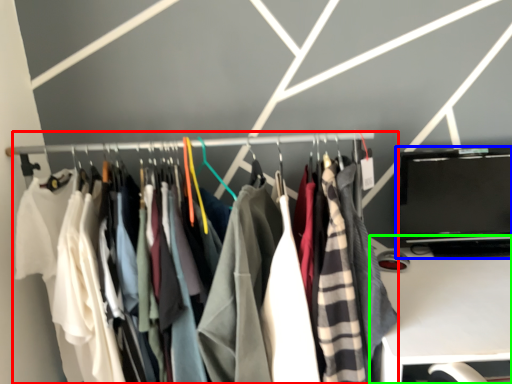
Question: Which object is the farthest from closet (highlighted by a red box)? Choose among these: laptop (highlighted by a blue box) or furniture (highlighted by a green box).

Choices:
 (A) laptop
 (B) furniture

Answer: (B)